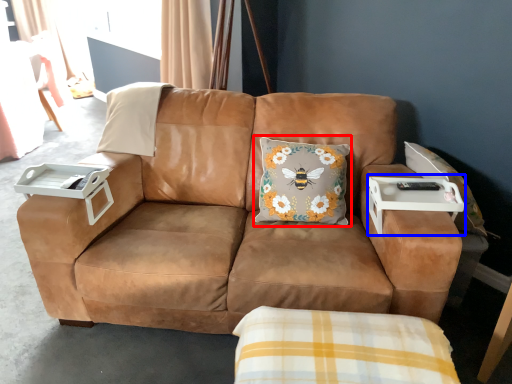
Question: Which of the following is the farthest to the observer, throw pillow (highlighted by a red box) or table (highlighted by a blue box)?

Choices:
 (A) throw pillow
 (B) table

Answer: (A)